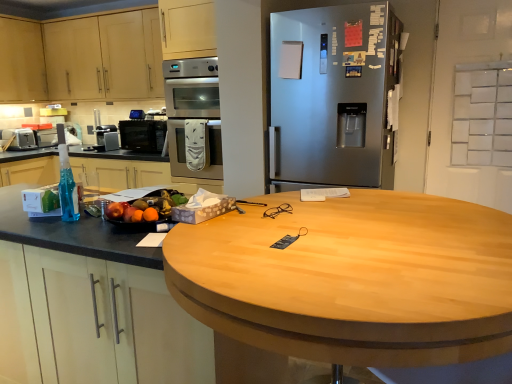
This screenshot has height=384, width=512. Describe the element at coordinates (143, 135) in the screenshot. I see `matte black microwave at center` at that location.

The height and width of the screenshot is (384, 512). I want to click on translucent blue liquid at left, so click(x=67, y=187).

Describe the element at coordinates (146, 206) in the screenshot. The width and height of the screenshot is (512, 384). I see `glossy plastic fruit bowl at left` at that location.

What do you see at coordinates (22, 62) in the screenshot? I see `matte wood cabinet at upper left, the 2th cabinetry viewed from the right` at bounding box center [22, 62].

What do you see at coordinates (19, 139) in the screenshot? This screenshot has width=512, height=384. I see `matte silver toaster at left, marked as the 1th appliance in a left-to-right arrangement` at bounding box center [19, 139].

Identify the location of matte black microwave at center. (143, 135).

Can we say matte black microwave at center lies outside translucent blue liquid at left?

Indeed, matte black microwave at center is completely outside translucent blue liquid at left.

Would you say matte black microwave at center is a long distance from translucent blue liquid at left?

Yes, matte black microwave at center and translucent blue liquid at left are quite far apart.

Which of these two, matte black microwave at center or translucent blue liquid at left, stands shorter?

Standing shorter between the two is matte black microwave at center.

From a real-world perspective, is matte black microwave at center above or below translucent blue liquid at left?

matte black microwave at center is below translucent blue liquid at left.

Can you confirm if wooden at left is positioned to the right of satin silver refrigerator at center?

In fact, wooden at left is to the left of satin silver refrigerator at center.

Is wooden at left aimed at satin silver refrigerator at center?

No, wooden at left is not facing towards satin silver refrigerator at center.

Considering the sizes of objects satin silver coffee maker at center, the second appliance positioned from the left, and glossy plastic fruit bowl at left in the image provided, who is shorter, satin silver coffee maker at center, the second appliance positioned from the left, or glossy plastic fruit bowl at left?

With less height is glossy plastic fruit bowl at left.

Looking at their sizes, would you say satin silver coffee maker at center, the second appliance positioned from the left, is wider or thinner than glossy plastic fruit bowl at left?

Clearly, satin silver coffee maker at center, the second appliance positioned from the left, has less width compared to glossy plastic fruit bowl at left.

Is satin silver coffee maker at center, which is counted as the 1th appliance, starting from the right, to the left or to the right of glossy plastic fruit bowl at left in the image?

satin silver coffee maker at center, which is counted as the 1th appliance, starting from the right, is positioned on glossy plastic fruit bowl at left's left side.

How many degrees apart are the facing directions of wooden at left and matte wood cabinet at upper left, the 2th cabinetry viewed from the right?

The facing directions of wooden at left and matte wood cabinet at upper left, the 2th cabinetry viewed from the right, are 1.91 degrees apart.

Considering the relative positions of wooden at left and matte wood cabinet at upper left, which is counted as the first cabinetry, starting from the left, in the image provided, is wooden at left to the right of matte wood cabinet at upper left, which is counted as the first cabinetry, starting from the left, from the viewer's perspective?

Correct, you'll find wooden at left to the right of matte wood cabinet at upper left, which is counted as the first cabinetry, starting from the left.

Is wooden at left with matte wood cabinet at upper left, which is counted as the first cabinetry, starting from the left?

No, wooden at left is not with matte wood cabinet at upper left, which is counted as the first cabinetry, starting from the left.

From a real-world perspective, which object stands above the other?

In real-world perspective, matte wood cabinet at upper left, the 2th cabinetry viewed from the right, is above.

Considering the relative sizes of translucent blue liquid at left and satin silver oven at center in the image provided, is translucent blue liquid at left shorter than satin silver oven at center?

Yes, translucent blue liquid at left is shorter than satin silver oven at center.

Could you tell me if translucent blue liquid at left is turned towards satin silver oven at center?

No, translucent blue liquid at left is not facing towards satin silver oven at center.

From a real-world perspective, relative to satin silver oven at center, is translucent blue liquid at left vertically above or below?

Clearly, from a real-world perspective, translucent blue liquid at left is below satin silver oven at center.

Considering the sizes of translucent blue liquid at left and satin silver oven at center in the image, is translucent blue liquid at left bigger or smaller than satin silver oven at center?

Considering their sizes, translucent blue liquid at left takes up less space than satin silver oven at center.

Between light wood cabinet at upper left, acting as the 2th cabinetry starting from the left, and satin silver refrigerator at center, which one appears on the left side from the viewer's perspective?

Positioned to the left is light wood cabinet at upper left, acting as the 2th cabinetry starting from the left.

Can you confirm if light wood cabinet at upper left, acting as the 2th cabinetry starting from the left, is taller than satin silver refrigerator at center?

No, light wood cabinet at upper left, acting as the 2th cabinetry starting from the left, is not taller than satin silver refrigerator at center.

From a real-world perspective, is light wood cabinet at upper left, the first cabinetry positioned from the right, physically located above or below satin silver refrigerator at center?

Clearly, from a real-world perspective, light wood cabinet at upper left, the first cabinetry positioned from the right, is above satin silver refrigerator at center.

Which object is thinner, light wood cabinet at upper left, the first cabinetry positioned from the right, or satin silver refrigerator at center?

Thinner between the two is light wood cabinet at upper left, the first cabinetry positioned from the right.

How different are the orientations of satin silver coffee maker at center, the second appliance positioned from the left, and satin silver oven at center in degrees?

satin silver coffee maker at center, the second appliance positioned from the left, and satin silver oven at center are facing 3.4 degrees away from each other.

Which is behind, satin silver coffee maker at center, the second appliance positioned from the left, or satin silver oven at center?

satin silver coffee maker at center, the second appliance positioned from the left, is more distant.

Could satin silver oven at center be considered to be inside satin silver coffee maker at center, which is counted as the 1th appliance, starting from the right?

No.

Where is `bottle below the matte black microwave at center (from the image's perspective)`? The height and width of the screenshot is (384, 512). bottle below the matte black microwave at center (from the image's perspective) is located at coordinates (67, 187).

Identify the location of refrigerator above the wooden at left (from the image's perspective). (334, 94).

Looking at this image, which object lies further to the anchor point wooden at left, matte silver toaster at left, marked as the 1th appliance in a left-to-right arrangement, or satin silver oven at center?

matte silver toaster at left, marked as the 1th appliance in a left-to-right arrangement, lies further to wooden at left than the other object.

Based on their spatial positions, is translucent blue liquid at left or satin silver refrigerator at center closer to satin silver oven at center?

Based on the image, satin silver refrigerator at center appears to be nearer to satin silver oven at center.

From the image, which object appears to be nearer to satin silver oven at center, glossy plastic fruit bowl at left or matte wood cabinet at upper left, which is counted as the first cabinetry, starting from the left?

The object closer to satin silver oven at center is glossy plastic fruit bowl at left.

Which object lies further to the anchor point translucent blue liquid at left, light wood cabinet at upper left, the first cabinetry positioned from the right, or satin silver oven at center?

light wood cabinet at upper left, the first cabinetry positioned from the right, is positioned further to the anchor translucent blue liquid at left.

Which object lies further to the anchor point glossy plastic fruit bowl at left, matte wood cabinet at upper left, the 2th cabinetry viewed from the right, or light wood cabinet at upper left, the first cabinetry positioned from the right?

matte wood cabinet at upper left, the 2th cabinetry viewed from the right.

Considering their positions, is wooden at left positioned further to matte black microwave at center than glossy plastic fruit bowl at left?

wooden at left.

Looking at this image, from the image, which object appears to be farther from glossy plastic fruit bowl at left, translucent blue liquid at left or satin silver oven at center?

satin silver oven at center is further to glossy plastic fruit bowl at left.

Considering their positions, is translucent blue liquid at left positioned closer to wooden at left than satin silver coffee maker at center, which is counted as the 1th appliance, starting from the right?

translucent blue liquid at left is positioned closer to the anchor wooden at left.

Locate an element on the screen. This screenshot has width=512, height=384. kitchen appliance positioned between wooden at left and satin silver coffee maker at center, which is counted as the 1th appliance, starting from the right, from near to far is located at coordinates (143, 135).

This screenshot has width=512, height=384. What are the coordinates of `refrigerator between wooden at left and matte silver toaster at left, which is the second appliance from right to left, in the front-back direction` in the screenshot? It's located at (334, 94).

You are a GUI agent. You are given a task and a screenshot of the screen. Output one action in this format:
    pyautogui.click(x=<x>, y=<y>)
    Task: Click on the cabinetry between wooden at left and matte wood cabinet at upper left, the 2th cabinetry viewed from the right, from front to back
    The height and width of the screenshot is (384, 512).
    Given the screenshot: What is the action you would take?
    click(82, 58)

Find the location of a particular element. oven between wooden at left and matte wood cabinet at upper left, the 2th cabinetry viewed from the right, along the z-axis is located at coordinates (193, 117).